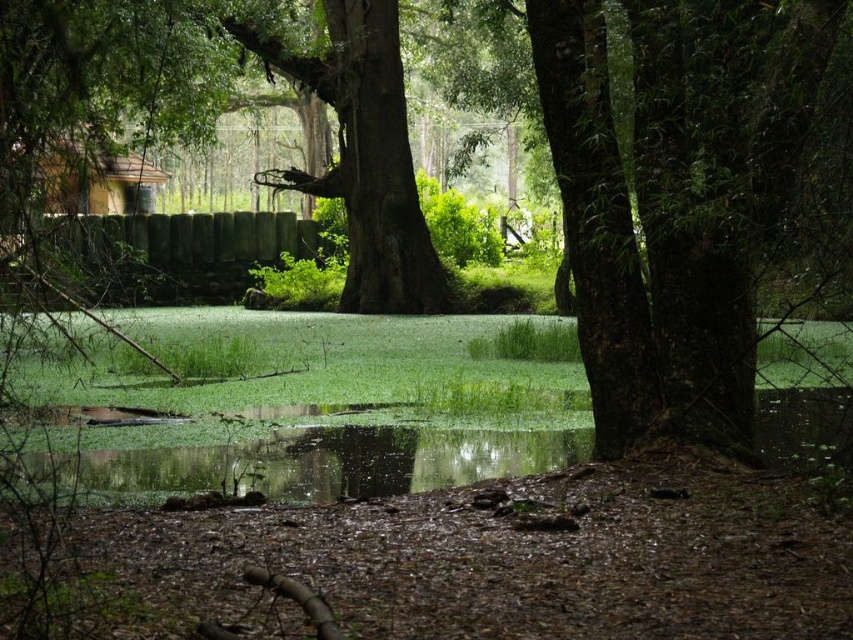
Question: Is green textured bark at right in front of green algae water at center?

Choices:
 (A) no
 (B) yes

Answer: (B)

Question: Estimate the real-world distances between objects in this image. Which object is closer to the green textured bark at right?

Choices:
 (A) green algae water at center
 (B) smooth brown tree trunk at center

Answer: (A)

Question: Can you confirm if smooth brown tree trunk at center is positioned above green algae water at center?

Choices:
 (A) no
 (B) yes

Answer: (B)

Question: Which point is farther to the camera?

Choices:
 (A) smooth brown tree trunk at center
 (B) green textured bark at right

Answer: (A)

Question: Does green textured bark at right lie in front of smooth brown tree trunk at center?

Choices:
 (A) yes
 (B) no

Answer: (A)

Question: Which object is the farthest from the smooth brown tree trunk at center?

Choices:
 (A) green textured bark at right
 (B) green algae water at center

Answer: (A)